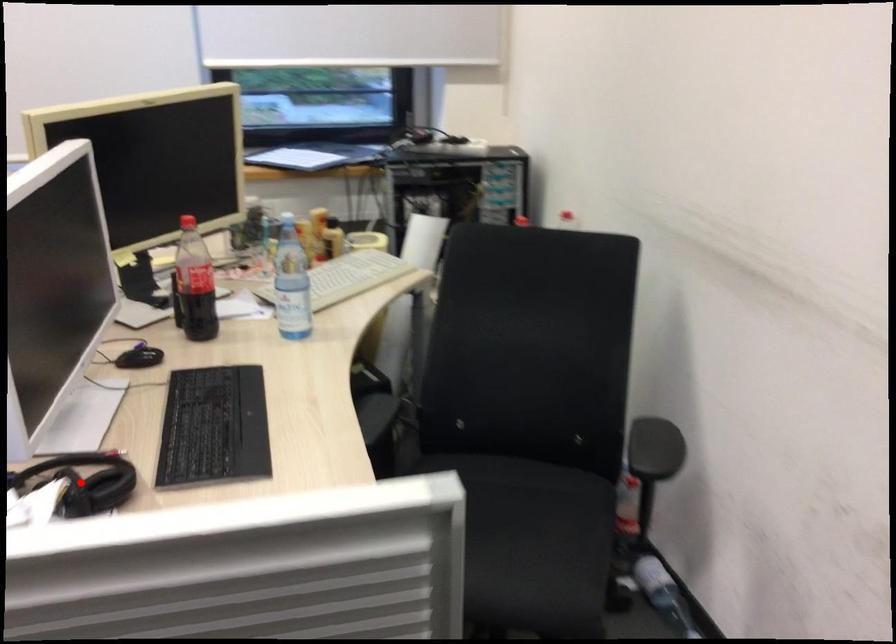
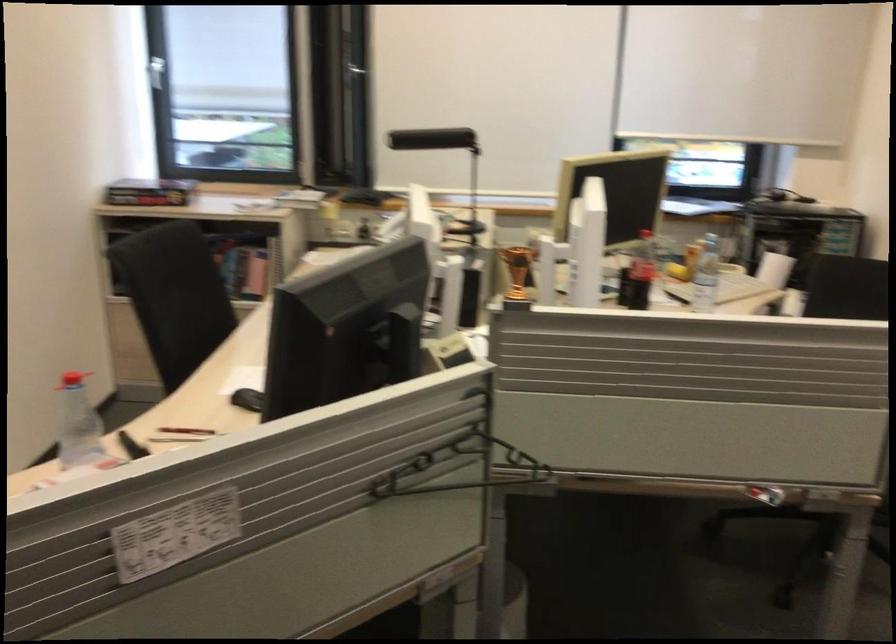
Question: I am providing you with two images of the same scene from different viewpoints. A red point is marked on the first image. Is the red point's position out of view in image 2?

Choices:
 (A) Yes
 (B) No

Answer: (A)